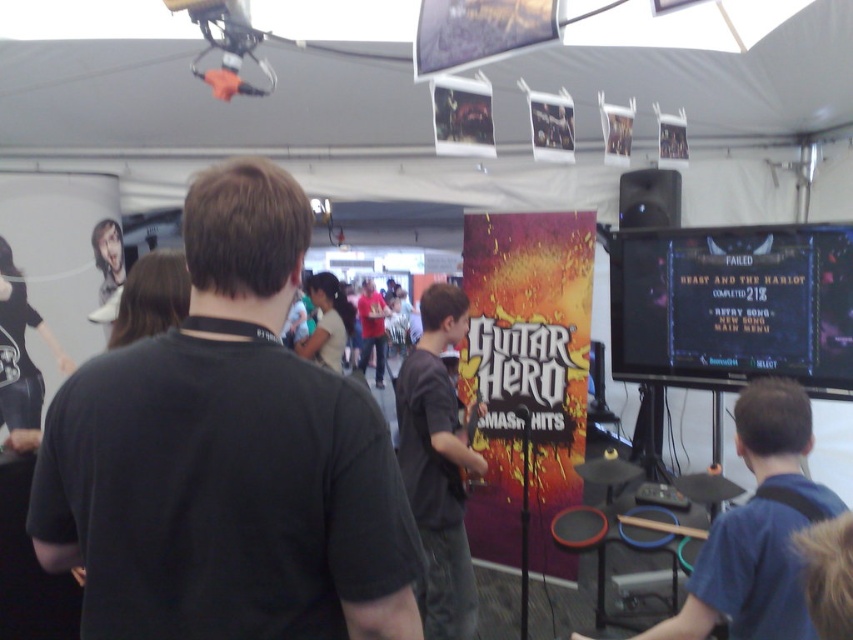
Is black matte t-shirt at center positioned behind orange vibrant poster at center?

No.

Locate an element on the screen. This screenshot has width=853, height=640. black matte t-shirt at center is located at coordinates (227, 456).

Locate an element on the screen. black matte t-shirt at center is located at coordinates (227, 456).

Which is above, black matte t-shirt at center or blue fabric shirt at center?

Positioned higher is black matte t-shirt at center.

Who is more forward, (x=344, y=561) or (x=759, y=621)?

Positioned in front is point (x=344, y=561).

The image size is (853, 640). In order to click on black matte t-shirt at center in this screenshot , I will do `click(227, 456)`.

Does point (465, 346) come behind point (773, 525)?

That is True.

In the scene shown: How much distance is there between orange vibrant poster at center and blue fabric shirt at center?

orange vibrant poster at center is 6.21 feet from blue fabric shirt at center.

At what (x,y) coordinates should I click in order to perform the action: click on orange vibrant poster at center. Please return your answer as a coordinate pair (x, y). This screenshot has height=640, width=853. Looking at the image, I should click on (526, 372).